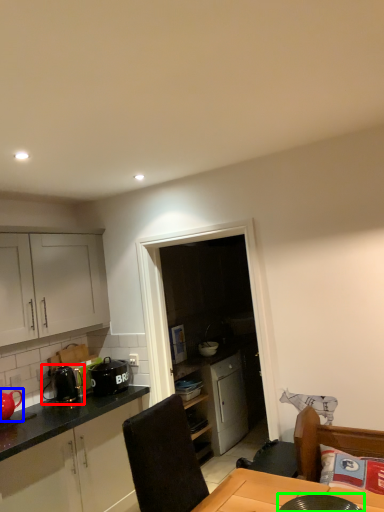
Question: Which object is positioned closest to appliance (highlighted by a red box)? Select from tea pot (highlighted by a blue box) and appliance (highlighted by a green box).

Choices:
 (A) tea pot
 (B) appliance

Answer: (A)